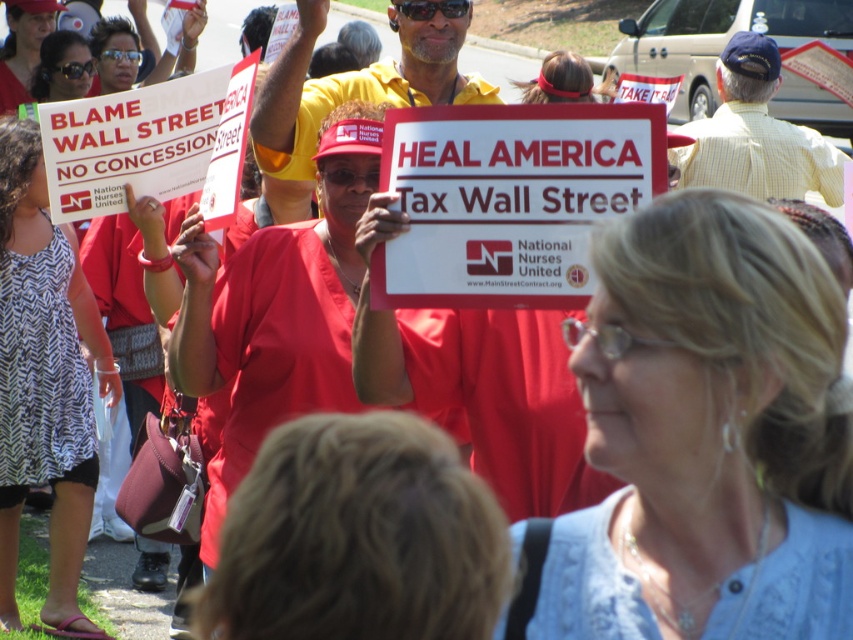
Looking at this image, you are part of a photography team documenting the protest. You need to capture a clear photo of both the matte red shirt at center and the matte red headband at center. Based on their positions, which one is more likely to be visible in the photo?

The matte red shirt at center is positioned over the matte red headband at center, so the shirt will be more visible in the photo as it is in front.

You are a photographer at the protest and want to capture both the matte red shirt at center and the matte red headband at center in a single frame. Based on their positions, can you fit both in the frame without moving the camera?

The matte red shirt at center might be wider than matte red headband at center, so there is a possibility that both can fit in the frame if the camera angle is adjusted to accommodate their widths.

What is located at the point marked by the coordinates (508,198) in the image?

The point marked by the coordinates (508,198) is located at the white paper sign at center.